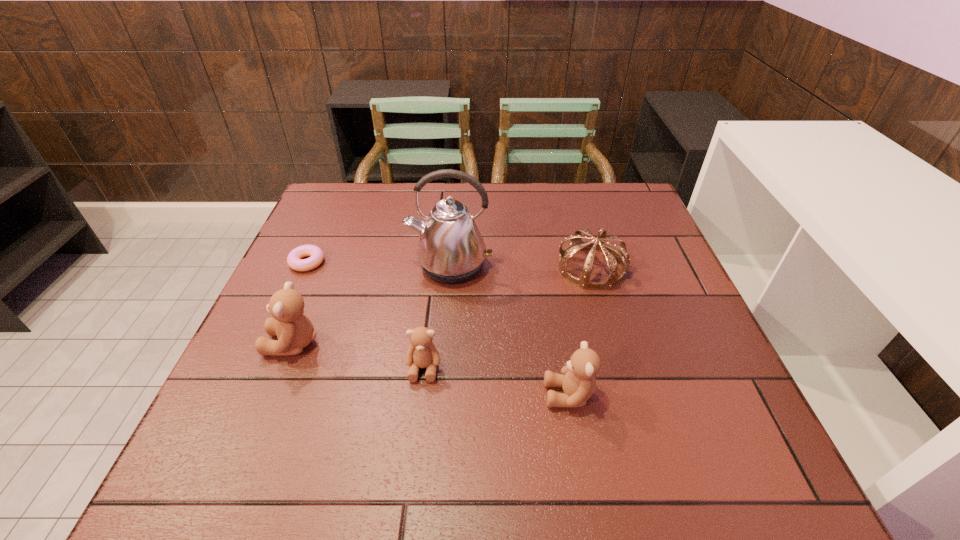
Image resolution: width=960 pixels, height=540 pixels. Identify the location of the fifth shortest object. [294, 330].

You are a GUI agent. You are given a task and a screenshot of the screen. Output one action in this format:
    pyautogui.click(x=<x>, y=<y>)
    Task: Click on the leftmost teddy bear
    This screenshot has height=540, width=960.
    Given the screenshot: What is the action you would take?
    pyautogui.click(x=294, y=330)

Where is `the second teddy bear from left to right`? the second teddy bear from left to right is located at coordinates (422, 353).

Identify the location of the fifth tallest object. (422, 353).

The height and width of the screenshot is (540, 960). I want to click on the rightmost teddy bear, so click(578, 381).

This screenshot has width=960, height=540. I want to click on tiara, so click(612, 255).

At what (x,y) coordinates should I click in order to perform the action: click on the tallest object. Please return your answer as a coordinate pair (x, y). The image size is (960, 540). Looking at the image, I should click on click(451, 250).

Where is `the shortest object`? the shortest object is located at coordinates (294, 259).

Where is `vacant region located 0.080m on the face of the shortest teddy bear`? Image resolution: width=960 pixels, height=540 pixels. vacant region located 0.080m on the face of the shortest teddy bear is located at coordinates (418, 420).

You are a GUI agent. You are given a task and a screenshot of the screen. Output one action in this format:
    pyautogui.click(x=<x>, y=<y>)
    Task: Click on the free spot located on the face of the rightmost teddy bear
    The width and height of the screenshot is (960, 540).
    Given the screenshot: What is the action you would take?
    pyautogui.click(x=358, y=395)